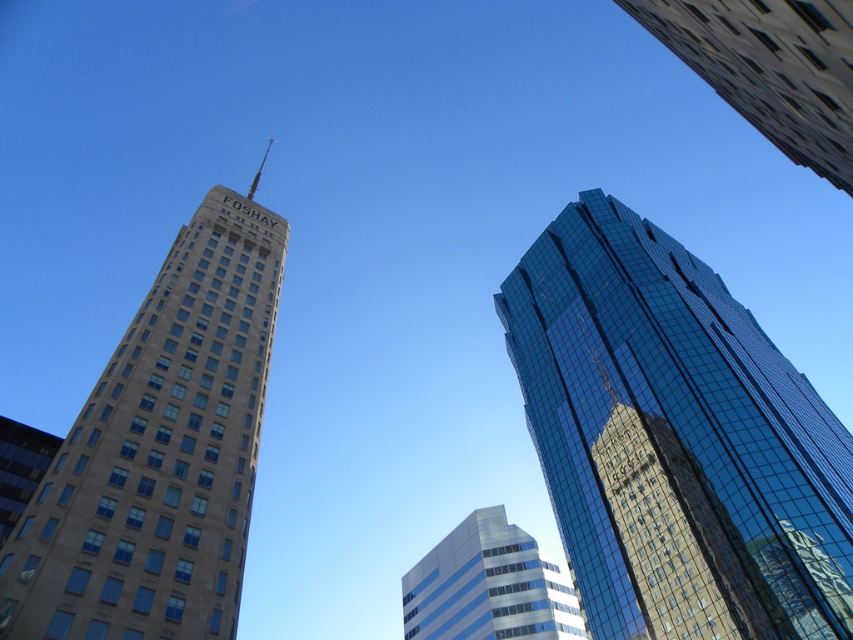
Question: In this image, where is shiny glass skyscraper at upper right located relative to silver glass building at center?

Choices:
 (A) above
 (B) below

Answer: (A)

Question: Which point is farther to the camera?

Choices:
 (A) (840, 100)
 (B) (583, 452)
 (C) (155, 618)
 (D) (413, 630)

Answer: (D)

Question: Can you confirm if shiny glass skyscraper at upper right is bigger than beige stone tower at left?

Choices:
 (A) yes
 (B) no

Answer: (A)

Question: Which object is farther from the camera taking this photo?

Choices:
 (A) shiny glass skyscraper at upper right
 (B) beige stone tower at left
 (C) glassy reflective skyscraper at upper right

Answer: (A)

Question: Which of these objects is positioned farthest from the shiny glass skyscraper at upper right?

Choices:
 (A) beige stone tower at left
 (B) glassy reflective skyscraper at upper right

Answer: (A)

Question: Where is shiny glass skyscraper at upper right located in relation to glassy reflective skyscraper at upper right in the image?

Choices:
 (A) left
 (B) right

Answer: (B)